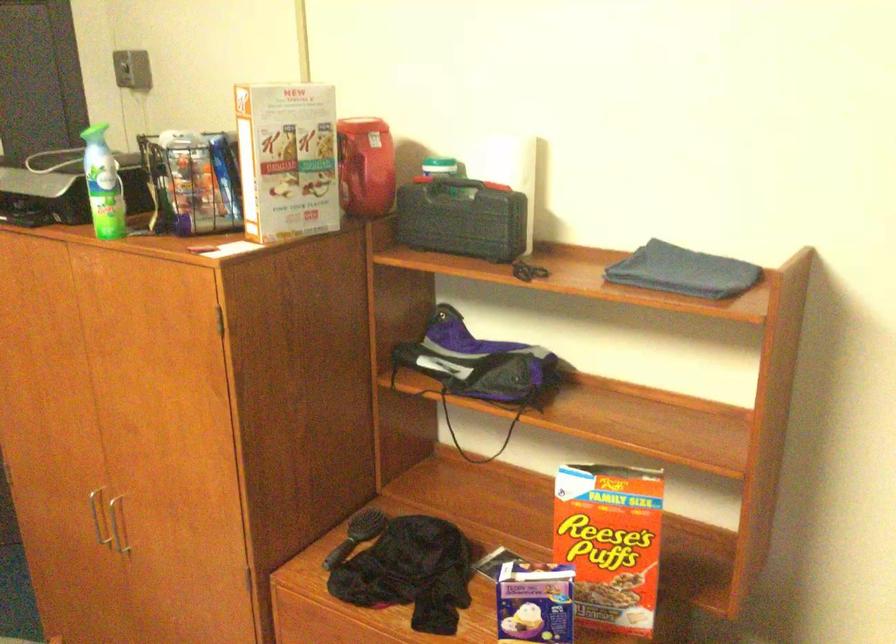
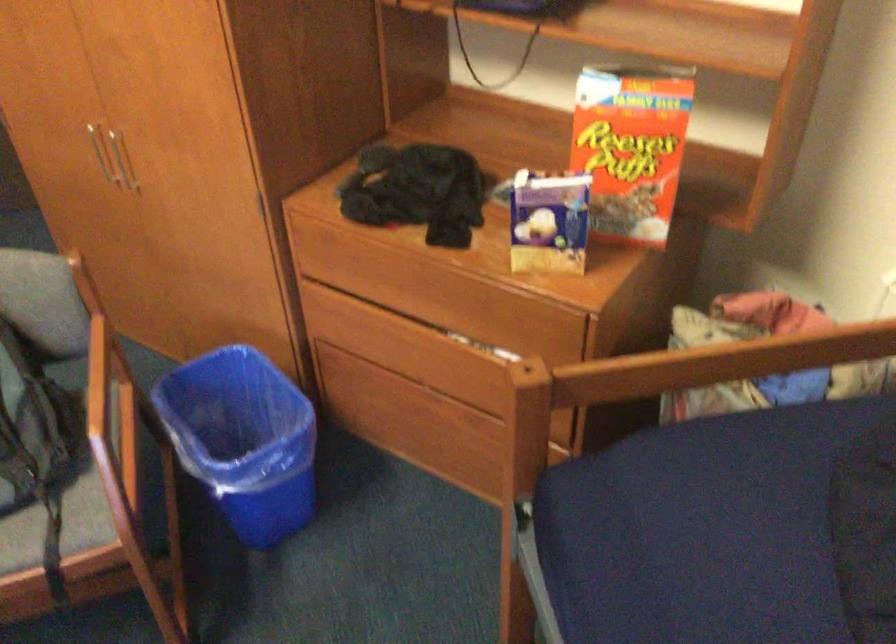
Question: The images are taken continuously from a first-person perspective. In which direction is your viewpoint rotating?

Choices:
 (A) Left
 (B) Right
 (C) Up
 (D) Down

Answer: (D)